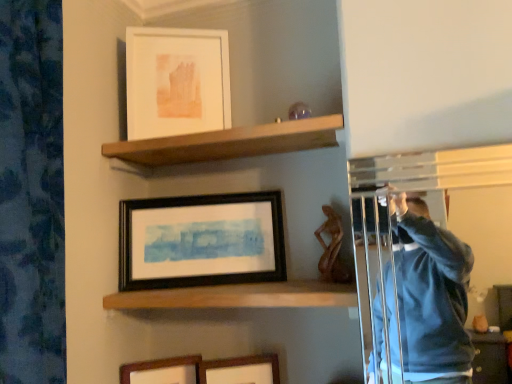
Image resolution: width=512 pixels, height=384 pixels. I want to click on vacant area situated below wooden shelf at upper center, which ranks as the 2th shelf in bottom-to-top order (from a real-world perspective), so click(x=234, y=279).